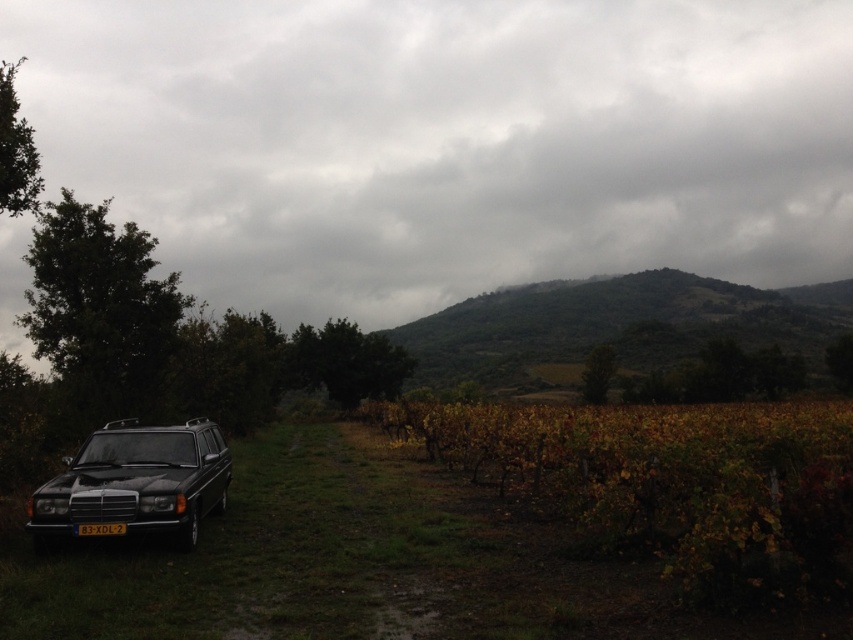
You are a delivery person who needs to park your van next to the matte black station wagon at lower left without blocking the black plastic license plate at lower left. Can you estimate if there is enough space between the two vehicles for your van?

The matte black station wagon at lower left might be wider than black plastic license plate at lower left, so there might not be enough space for your van to park without blocking the license plate. Please check the actual width before parking.

You are a delivery driver who needs to park your truck in this area. You see the matte black station wagon at lower left and the black plastic license plate at lower left. Which object is positioned further to the left?

The matte black station wagon at lower left is positioned further to the left than the black plastic license plate at lower left.

From the picture: You are a delivery driver who needs to park your car next to the matte black station wagon at lower left. The parking space has a width of 70 centimeters. Can you safely park your car without hitting the black plastic license plate at lower left?

The matte black station wagon at lower left is 72.28 centimeters from the black plastic license plate at lower left. Since the parking space is only 70 centimeters wide, parking there would likely cause your car to hit the license plate.